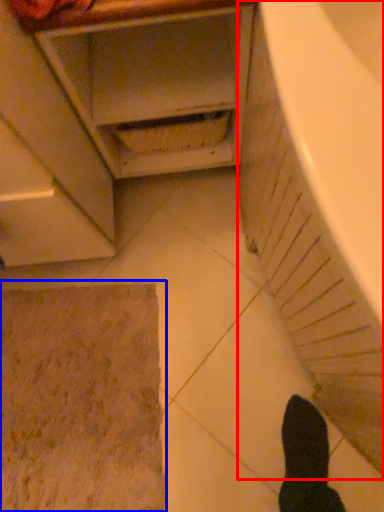
Question: Which object is further to the camera taking this photo, bath (highlighted by a red box) or bath mat (highlighted by a blue box)?

Choices:
 (A) bath
 (B) bath mat

Answer: (B)